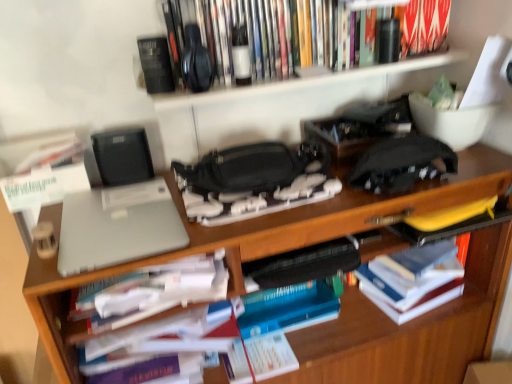
Question: Does point tap(207, 46) appear closer or farther from the camera than point tap(69, 279)?

Choices:
 (A) farther
 (B) closer

Answer: (A)

Question: Considering the positions of hardcover books at upper center, the 1th book from the top, and wooden desk at center in the image, is hardcover books at upper center, the 1th book from the top, wider or thinner than wooden desk at center?

Choices:
 (A) wide
 (B) thin

Answer: (B)

Question: Which of these objects is positioned closest to the hardcover books at upper center, the 1th book from the top?

Choices:
 (A) hardcover book at right, the 1th book ordered from the bottom
 (B) matte gray laptop at center, the 2th book when ordered from bottom to top
 (C) wooden bookshelf at upper center
 (D) white paper at center
 (E) sleek silver laptop at left

Answer: (C)

Question: Estimate the real-world distances between objects in this image. Which object is farther from the wooden desk at center?

Choices:
 (A) hardcover book at right, the 1th book ordered from the bottom
 (B) white paper at center
 (C) matte gray laptop at center, the 2th book when ordered from bottom to top
 (D) hardcover books at upper center, the third book in the bottom-to-top sequence
 (E) wooden bookshelf at upper center

Answer: (D)